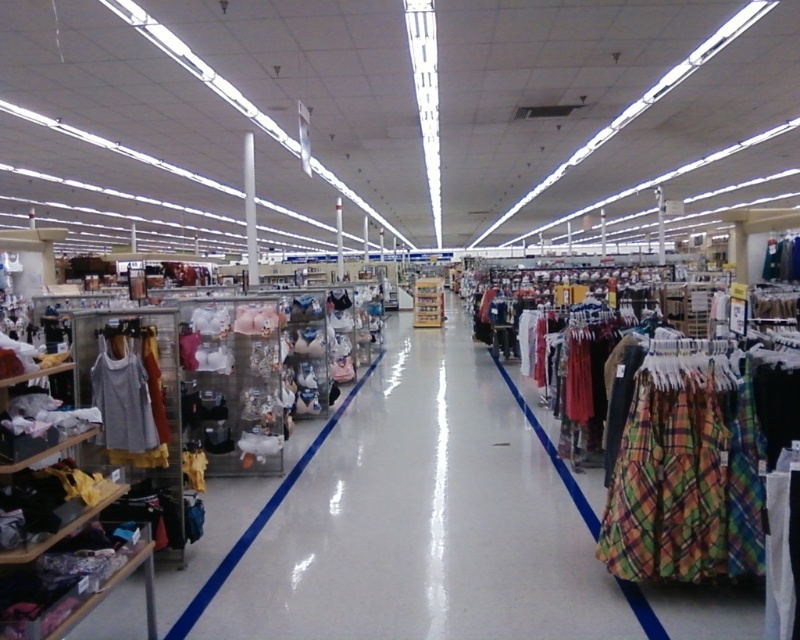
You are a store employee who needs to place the light gray fabric tank top at left into the clear plastic bins at center. Will the tank top fit inside the bin?

The clear plastic bins at center is bigger than the light gray fabric tank top at left, so yes, the tank top will fit inside the bin.

Consider the image. You are a store employee who needs to retrieve an item from the clear plastic bins at center and the light gray fabric tank top at left. Which object should you approach first to reach the one closer to you?

The clear plastic bins at center should be approached first since they are closer to the viewer than the light gray fabric tank top at left.